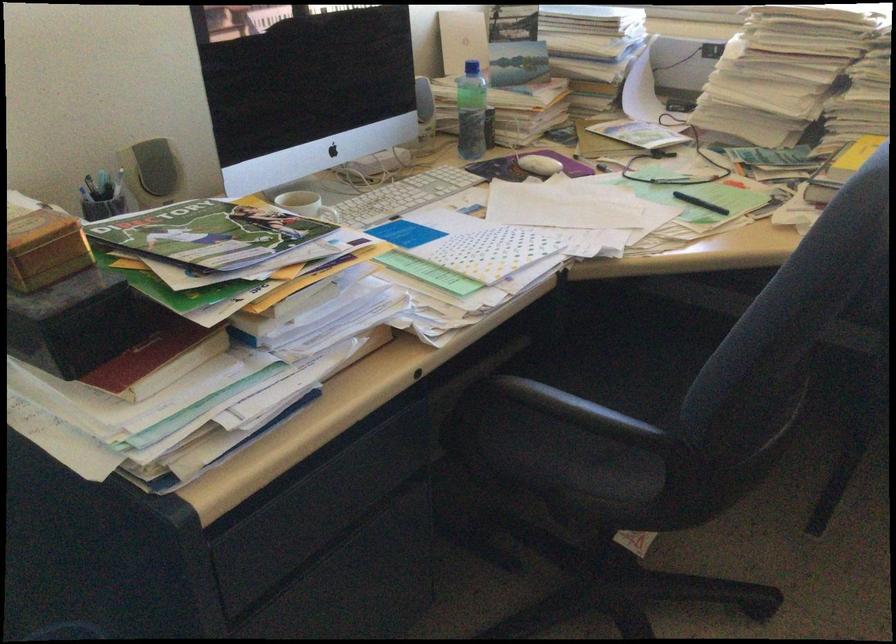
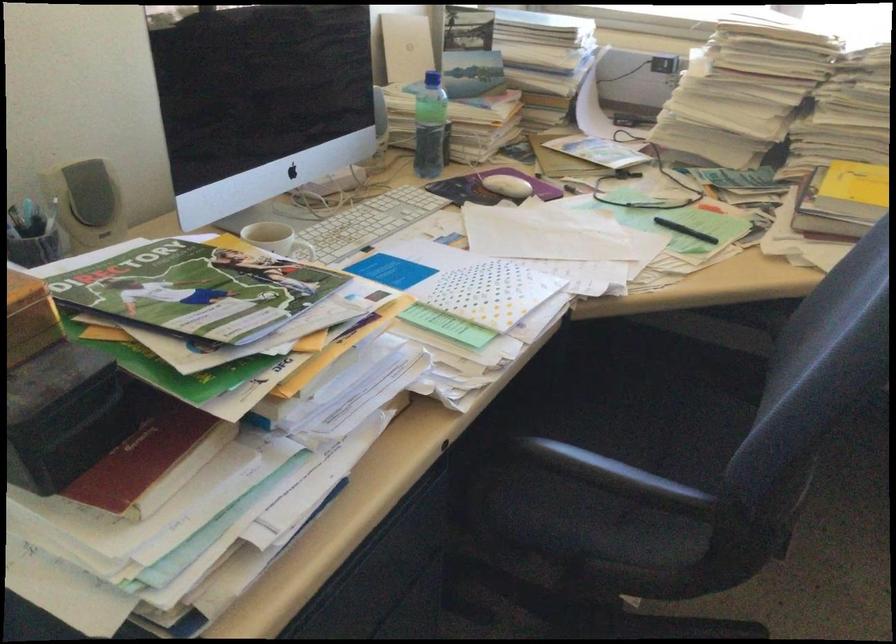
Locate, in the second image, the point that corresponds to pixel 561 404 in the first image.

(614, 474)